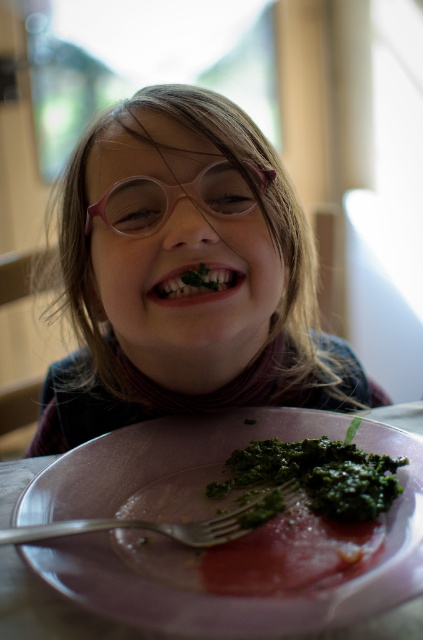
Question: Does green leafymaterial/textureplatter at lower center appear under silver metallic fork at lower center?

Choices:
 (A) yes
 (B) no

Answer: (B)

Question: Does pink plastic glasses at upper center appear on the right side of green leafymaterial/textureplatter at lower center?

Choices:
 (A) yes
 (B) no

Answer: (B)

Question: Which is farther from the green leafymaterial/texturebroccoli at lower center?

Choices:
 (A) pink plastic glasses at center
 (B) green leafymaterial/textureplatter at lower center
 (C) silver metallic fork at lower center
 (D) pink plastic glasses at upper center

Answer: (A)

Question: Based on their relative distances, which object is nearer to the pink plastic glasses at upper center?

Choices:
 (A) green leafymaterial/texturebroccoli at lower center
 (B) silver metallic fork at lower center
 (C) pink plastic glasses at center

Answer: (C)

Question: Which point is farther from the camera taking this photo?

Choices:
 (A) (271, 444)
 (B) (233, 173)
 (C) (13, 532)
 (D) (118, 483)

Answer: (B)

Question: Is green leafymaterial/textureplatter at lower center thinner than pink plastic glasses at center?

Choices:
 (A) yes
 (B) no

Answer: (B)